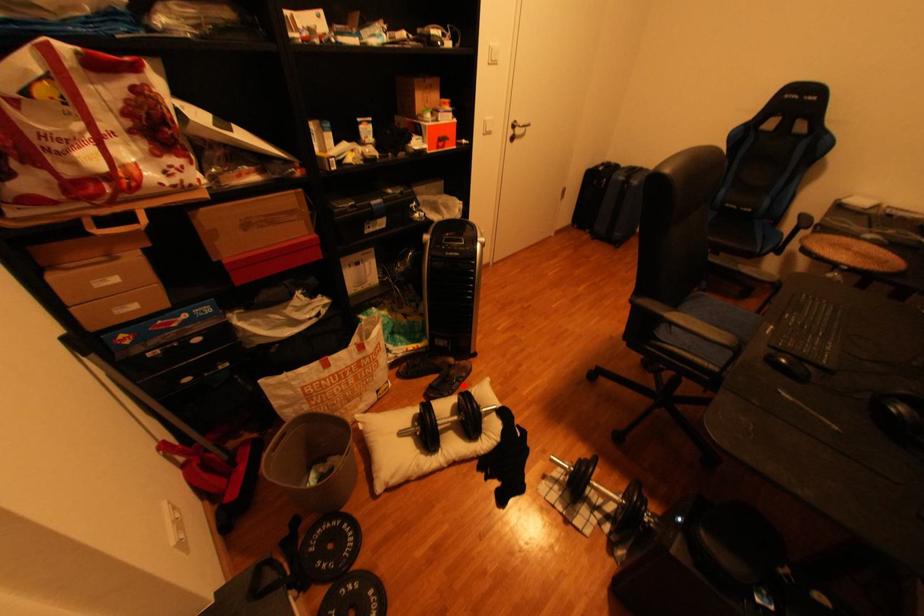
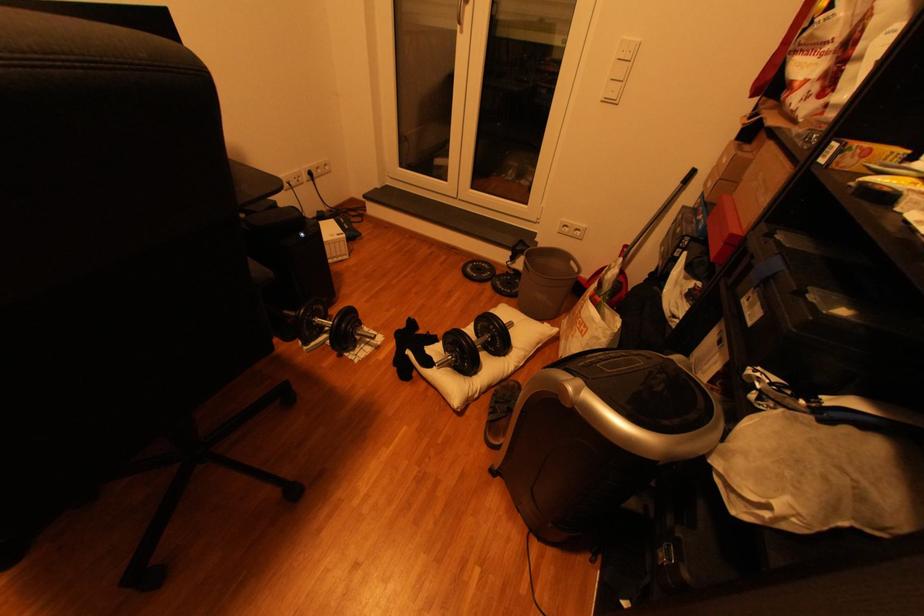
Question: I am providing you with two images of the same scene from different viewpoints. In image1, a red point is highlighted. Considering the same 3D point in image2, which of the following is correct?

Choices:
 (A) It is closer
 (B) It is farther

Answer: (A)